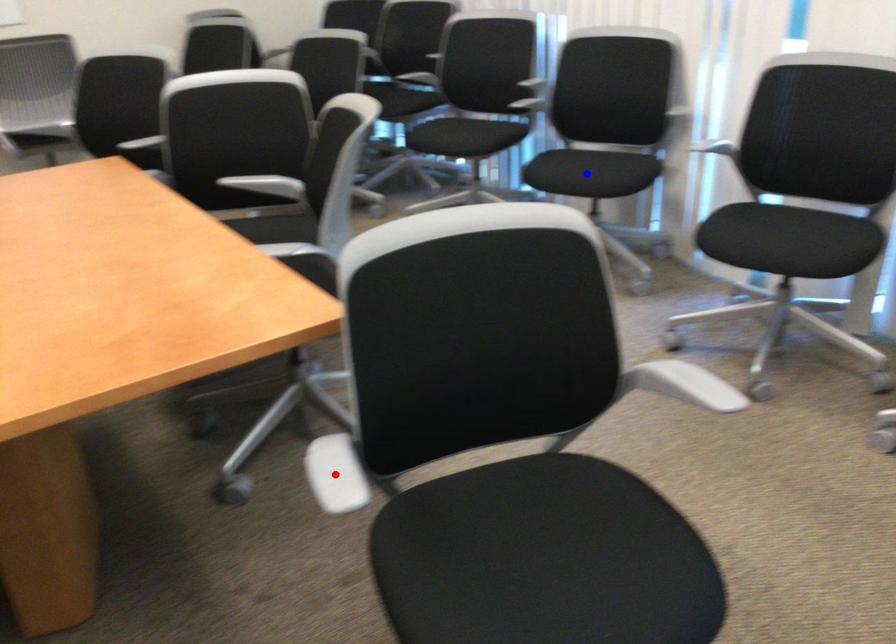
Question: In the image, two points are highlighted. Which point is nearer to the camera? Reply with the corresponding letter.

Choices:
 (A) blue point
 (B) red point

Answer: (B)